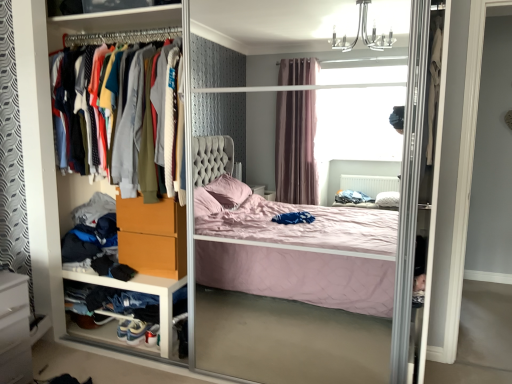
Question: Based on their sizes in the image, would you say white plastic drawer at lower left is bigger or smaller than matte plastic screen door at center?

Choices:
 (A) big
 (B) small

Answer: (B)

Question: Is white plastic drawer at lower left wider or thinner than matte plastic screen door at center?

Choices:
 (A) wide
 (B) thin

Answer: (B)

Question: Which is farther from the white leather shoe at lower left, which ranks as the 1th shoe in right-to-left order?

Choices:
 (A) white suede sneaker at lower left, placed as the 1th shoe when sorted from left to right
 (B) white glossy vanity at lower left
 (C) white plastic drawer at lower left
 (D) knit sweater at left
 (E) matte orange drawer at lower left

Answer: (D)

Question: Considering the real-world distances, which object is closest to the white plastic drawer at lower left?

Choices:
 (A) matte plastic screen door at center
 (B) white suede sneaker at lower left, which appears as the 2th shoe when viewed from the right
 (C) matte orange drawer at lower left
 (D) knit sweater at left
 (E) white glossy vanity at lower left

Answer: (C)